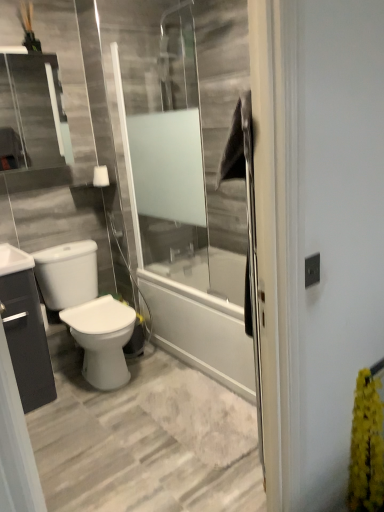
Describe the element at coordinates (25, 329) in the screenshot. This screenshot has width=384, height=512. I see `matte black cabinet at left` at that location.

You are a GUI agent. You are given a task and a screenshot of the screen. Output one action in this format:
    pyautogui.click(x=<x>, y=<y>)
    Task: Click on the white glossy toilet at lower left
    The width and height of the screenshot is (384, 512).
    Given the screenshot: What is the action you would take?
    pyautogui.click(x=87, y=310)

Does point (359, 431) come farther from viewer compared to point (6, 263)?

No, it is in front of (6, 263).

From the image's perspective, which one is positioned higher, yellow fluffy plant at right or matte black cabinet at left?

matte black cabinet at left, from the image's perspective.

In the image, there is a matte black cabinet at left. At what (x,y) coordinates should I click in order to perform the action: click on flower below it (from a real-world perspective). Please return your answer as a coordinate pair (x, y). The image size is (384, 512). Looking at the image, I should click on (367, 446).

From a real-world perspective, is yellow fluffy plant at right physically below matte black cabinet at left?

Yes, from a real-world perspective, yellow fluffy plant at right is below matte black cabinet at left.

From the image's perspective, is matte black cabinet at left on yellow fluffy plant at right?

Yes.

Find the location of a particular element. bathroom cabinet on the left of yellow fluffy plant at right is located at coordinates (25, 329).

Does matte black cabinet at left have a lesser width compared to yellow fluffy plant at right?

No, matte black cabinet at left is not thinner than yellow fluffy plant at right.

Is matte black cabinet at left aimed at yellow fluffy plant at right?

No, matte black cabinet at left is not aimed at yellow fluffy plant at right.

Do you think white glossy toilet at lower left is within yellow fluffy plant at right, or outside of it?

white glossy toilet at lower left is located beyond the bounds of yellow fluffy plant at right.

Is the depth of white glossy toilet at lower left greater than that of yellow fluffy plant at right?

Yes, it is.

Considering the relative positions of white glossy toilet at lower left and yellow fluffy plant at right in the image provided, is white glossy toilet at lower left to the left of yellow fluffy plant at right from the viewer's perspective?

Indeed, white glossy toilet at lower left is positioned on the left side of yellow fluffy plant at right.

Consider the image. From the image's perspective, which is above, white glossy toilet at lower left or yellow fluffy plant at right?

white glossy toilet at lower left appears higher in the image.

Is yellow fluffy plant at right inside or outside of white glossy toilet at lower left?

yellow fluffy plant at right exists outside the volume of white glossy toilet at lower left.

Between yellow fluffy plant at right and white glossy toilet at lower left, which one appears on the left side from the viewer's perspective?

white glossy toilet at lower left is more to the left.

Is there a large distance between yellow fluffy plant at right and white glossy toilet at lower left?

Yes, yellow fluffy plant at right and white glossy toilet at lower left are located far from each other.

From a real-world perspective, does matte black cabinet at left sit lower than white glossy toilet at lower left?

Yes, from a real-world perspective, matte black cabinet at left is under white glossy toilet at lower left.

Which is farther, (24, 345) or (86, 322)?

The point (86, 322) is farther from the camera.

From the image's perspective, which object appears higher, matte black cabinet at left or white glossy toilet at lower left?

white glossy toilet at lower left.

Does white glossy toilet at lower left touch matte black cabinet at left?

No.

Which is more distant, [61,271] or [26,275]?

The point [61,271] is farther from the camera.

From the image's perspective, between white glossy toilet at lower left and matte black cabinet at left, who is located below?

From the image's view, matte black cabinet at left is below.

The width and height of the screenshot is (384, 512). In the image, there is a matte black cabinet at left. Identify the location of flower below it (from a real-world perspective). (367, 446).

The image size is (384, 512). What are the coordinates of `flower located in front of the matte black cabinet at left` in the screenshot? It's located at (367, 446).

Which object lies nearer to the anchor point white glossy toilet at lower left, matte black cabinet at left or yellow fluffy plant at right?

matte black cabinet at left is positioned closer to the anchor white glossy toilet at lower left.

From the image, which object appears to be nearer to matte black cabinet at left, yellow fluffy plant at right or white glossy toilet at lower left?

white glossy toilet at lower left lies closer to matte black cabinet at left than the other object.

Considering their positions, is yellow fluffy plant at right positioned further to white glossy toilet at lower left than matte black cabinet at left?

The object further to white glossy toilet at lower left is yellow fluffy plant at right.

Estimate the real-world distances between objects in this image. Which object is further from yellow fluffy plant at right, white glossy toilet at lower left or matte black cabinet at left?

matte black cabinet at left is further to yellow fluffy plant at right.

Which object lies further to the anchor point yellow fluffy plant at right, matte black cabinet at left or white glossy toilet at lower left?

Based on the image, matte black cabinet at left appears to be further to yellow fluffy plant at right.

When comparing their distances from matte black cabinet at left, does white glossy toilet at lower left or yellow fluffy plant at right seem closer?

white glossy toilet at lower left lies closer to matte black cabinet at left than the other object.

At what (x,y) coordinates should I click in order to perform the action: click on gray between matte black cabinet at left and yellow fluffy plant at right in the horizontal direction. Please return your answer as a coordinate pair (x, y). The image size is (384, 512). Looking at the image, I should click on (87, 310).